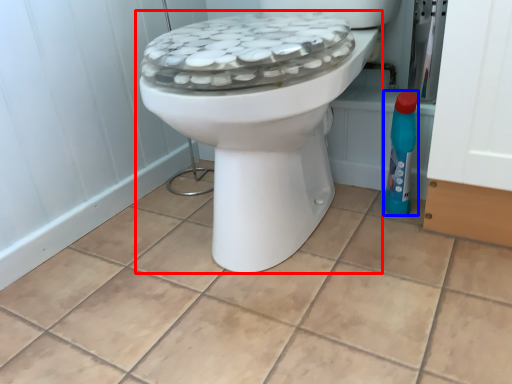
Question: Among these objects, which one is farthest to the camera, toilet (highlighted by a red box) or cleaning product (highlighted by a blue box)?

Choices:
 (A) toilet
 (B) cleaning product

Answer: (B)